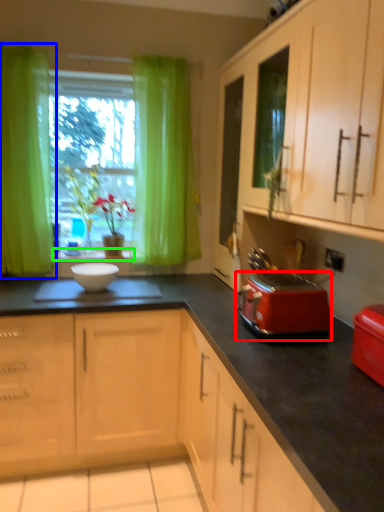
Question: Based on their relative distances, which object is nearer to kitchen appliance (highlighted by a red box)? Choose from curtain (highlighted by a blue box) and window sill (highlighted by a green box).

Choices:
 (A) curtain
 (B) window sill

Answer: (B)